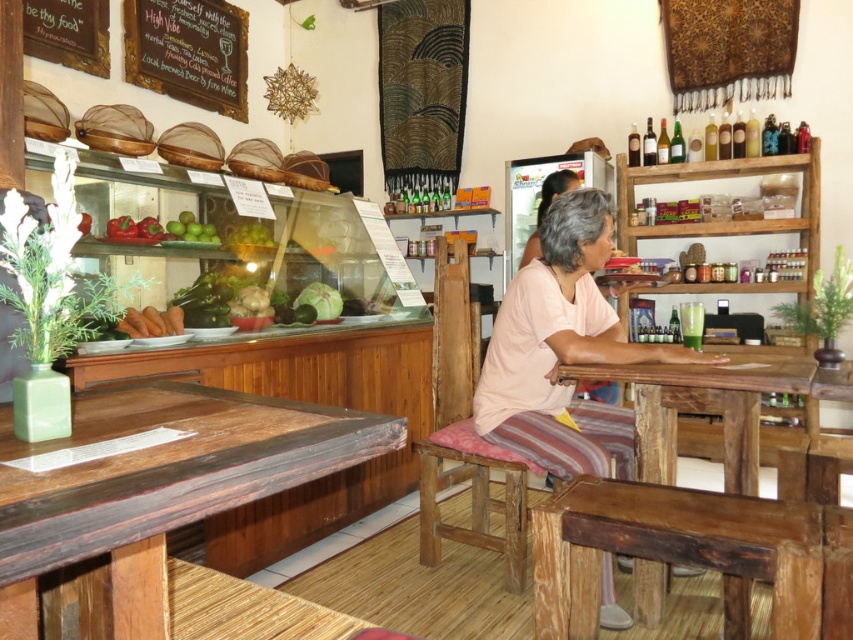
Question: Does wooden table at center come behind pink fabric cushion at center?

Choices:
 (A) no
 (B) yes

Answer: (A)

Question: From the image, what is the correct spatial relationship of wooden chalkboard at upper left in relation to green matte apples at upper center?

Choices:
 (A) left
 (B) right

Answer: (A)

Question: Which point is farther to the camera?

Choices:
 (A) green matte apples at upper center
 (B) wooden table at center
 (C) wooden chalkboard at upper left

Answer: (C)

Question: Which object is the farthest from the wooden table at center?

Choices:
 (A) green matte apples at upper center
 (B) pink fabric cushion at center

Answer: (A)

Question: Based on their relative distances, which object is nearer to the green matte apples at upper center?

Choices:
 (A) wooden chair at center
 (B) rustic wood table at center
 (C) pink fabric cushion at center

Answer: (A)

Question: Is wooden chair at center in front of green matte apples at upper center?

Choices:
 (A) yes
 (B) no

Answer: (A)